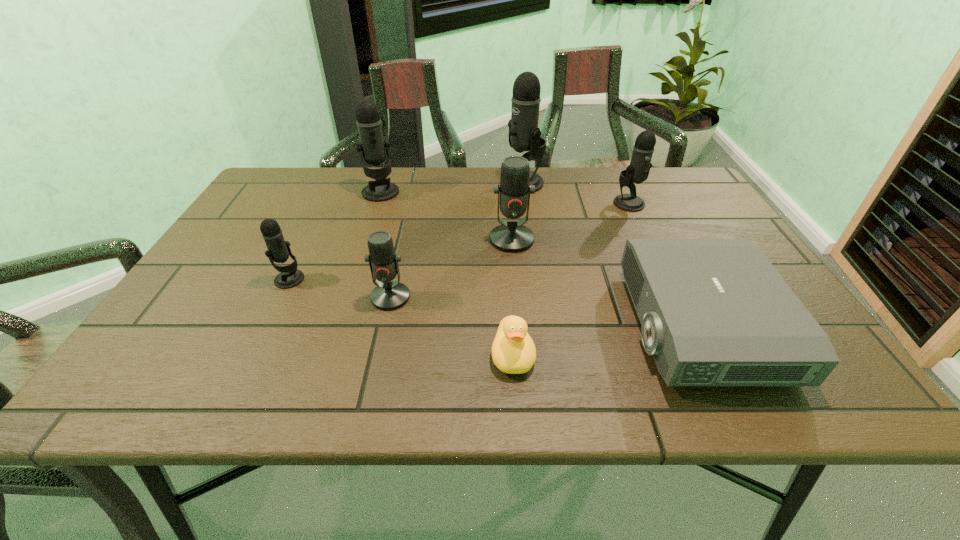
Locate an element on the screen. Image resolution: width=960 pixels, height=540 pixels. the smaller red microphone is located at coordinates (386, 296).

At what (x,y) coordinates should I click in order to perform the action: click on the nearer red microphone. Please return your answer as a coordinate pair (x, y). The image size is (960, 540). Looking at the image, I should click on (386, 296).

The image size is (960, 540). I want to click on projector, so click(x=714, y=312).

At what (x,y) coordinates should I click in order to perform the action: click on duck. Please return your answer as a coordinate pair (x, y). Looking at the image, I should click on (513, 351).

Identify the location of free space located 0.270m on the right of the tallest object. tap(633, 183).

You are a GUI agent. You are given a task and a screenshot of the screen. Output one action in this format:
    pyautogui.click(x=<x>, y=<y>)
    Task: Click on the free space located 0.050m on the front of the fifth shortest microphone
    This screenshot has height=540, width=960.
    Given the screenshot: What is the action you would take?
    pyautogui.click(x=373, y=212)

In order to click on vacant space located 0.330m on the side of the farther red microphone with the red ring in this screenshot , I will do `click(523, 360)`.

Where is `free space located 0.050m on the right of the rightmost black microphone`? This screenshot has height=540, width=960. free space located 0.050m on the right of the rightmost black microphone is located at coordinates (661, 203).

Identify the location of blank area located 0.370m on the right of the smallest black microphone. (466, 279).

The height and width of the screenshot is (540, 960). I want to click on free spot located 0.220m on the side of the smaller red microphone with the red ring, so click(368, 401).